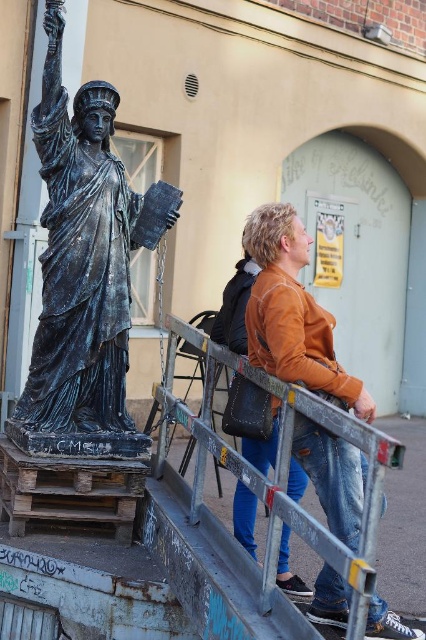
Between point (112, 189) and point (313, 326), which one is positioned behind?

The point (112, 189) is behind.

The width and height of the screenshot is (426, 640). Describe the element at coordinates (80, 269) in the screenshot. I see `bronze statue at left` at that location.

Locate an element on the screen. bronze statue at left is located at coordinates (80, 269).